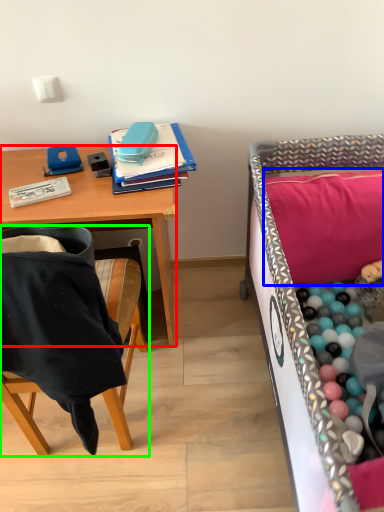
Question: Which object is the closest to the desk (highlighted by a red box)? Choose among these: pillow (highlighted by a blue box) or chair (highlighted by a green box).

Choices:
 (A) pillow
 (B) chair

Answer: (B)